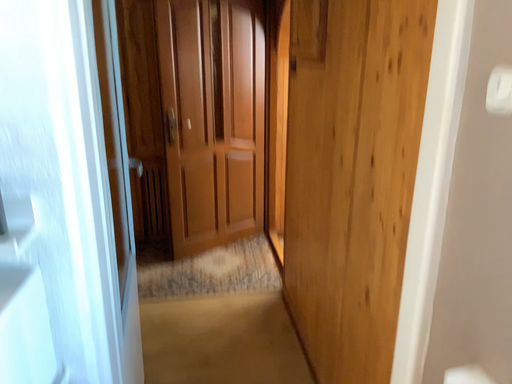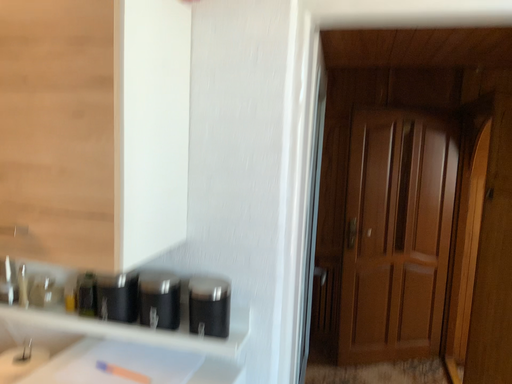
Question: How did the camera likely rotate when shooting the video?

Choices:
 (A) rotated right
 (B) rotated left

Answer: (B)